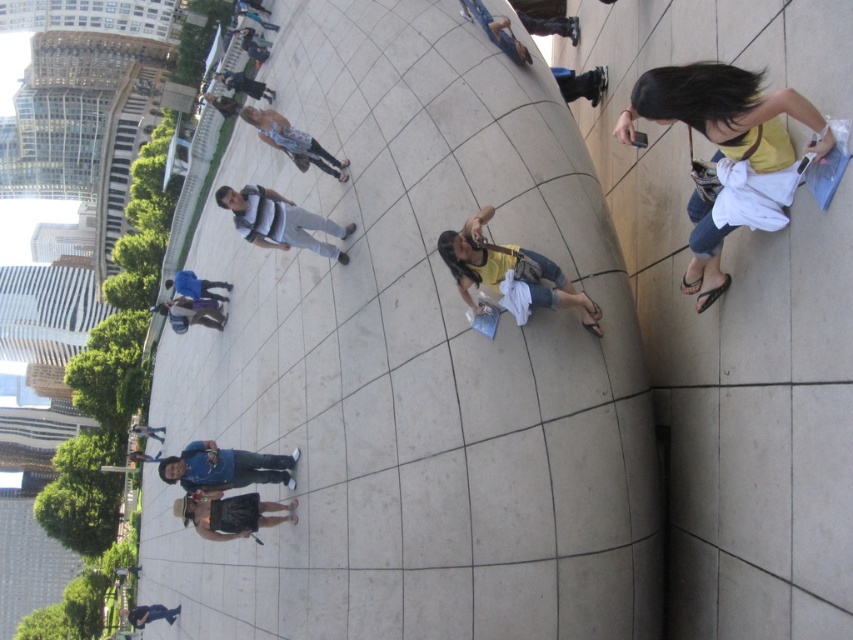
Question: Is light brown leather jacket at center positioned before denim shorts at lower center?

Choices:
 (A) yes
 (B) no

Answer: (A)

Question: Does striped jersey at center appear over matte black camera at upper center?

Choices:
 (A) no
 (B) yes

Answer: (A)

Question: Among these objects, which one is nearest to the camera?

Choices:
 (A) brown leather hat at lower center
 (B) blue fabric shirt at center
 (C) denim jeans at center

Answer: (A)

Question: Does yellow cotton shirt at right appear on the left side of brown leather hat at lower center?

Choices:
 (A) yes
 (B) no

Answer: (B)

Question: Which point is farther to the camera?

Choices:
 (A) blue denim jeans at upper center
 (B) matte black camera at upper center
 (C) light brown leather jacket at center
 (D) dark blue jeans at lower left

Answer: (A)

Question: Among these points, which one is nearest to the camera?

Choices:
 (A) (785, 90)
 (B) (332, 253)
 (C) (194, 451)
 (D) (554, 264)

Answer: (A)